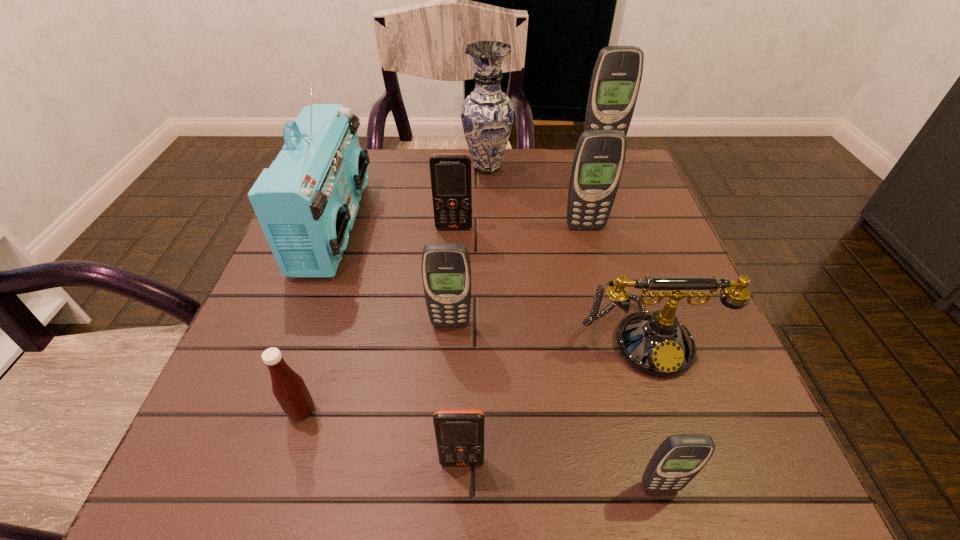
Find the location of a particular element. The image size is (960, 540). free space that is in between the white Tabasco sauce and the blue radio receiver is located at coordinates (318, 319).

Identify the location of vacant space in between the telephone and the fourth farthest cellular telephone. This screenshot has height=540, width=960. (548, 330).

You are a GUI agent. You are given a task and a screenshot of the screen. Output one action in this format:
    pyautogui.click(x=<x>, y=<y>)
    Task: Click on the free space between the black telephone and the white Tabasco sauce
    The width and height of the screenshot is (960, 540).
    Given the screenshot: What is the action you would take?
    pyautogui.click(x=473, y=374)

Identify the location of vacant point located between the nearest object and the black telephone. This screenshot has height=540, width=960. (653, 412).

Find the location of a particular element. free spot between the white Tabasco sauce and the radio receiver is located at coordinates (318, 319).

Identify which object is the third closest to the nearest object. Please provide its 2D coordinates. Your answer should be formatted as a tuple, i.e. [(x, y)], where the tuple contains the x and y coordinates of a point satisfying the conditions above.

[(446, 269)]

Locate which object is the fourth closest to the eighth farthest object. Please provide its 2D coordinates. Your answer should be formatted as a tuple, i.e. [(x, y)], where the tuple contains the x and y coordinates of a point satisfying the conditions above.

[(655, 343)]

Select which cellular telephone appears as the fourth closest to the smaller orange cellular telephone. Please provide its 2D coordinates. Your answer should be formatted as a tuple, i.e. [(x, y)], where the tuple contains the x and y coordinates of a point satisfying the conditions above.

[(598, 162)]

Locate which cellular telephone is the fifth closest to the biggest gray cellular telephone. Please provide its 2D coordinates. Your answer should be formatted as a tuple, i.e. [(x, y)], where the tuple contains the x and y coordinates of a point satisfying the conditions above.

[(459, 433)]

Identify which gray cellular telephone is the third closest to the blue radio receiver. Please provide its 2D coordinates. Your answer should be formatted as a tuple, i.e. [(x, y)], where the tuple contains the x and y coordinates of a point satisfying the conditions above.

[(616, 78)]